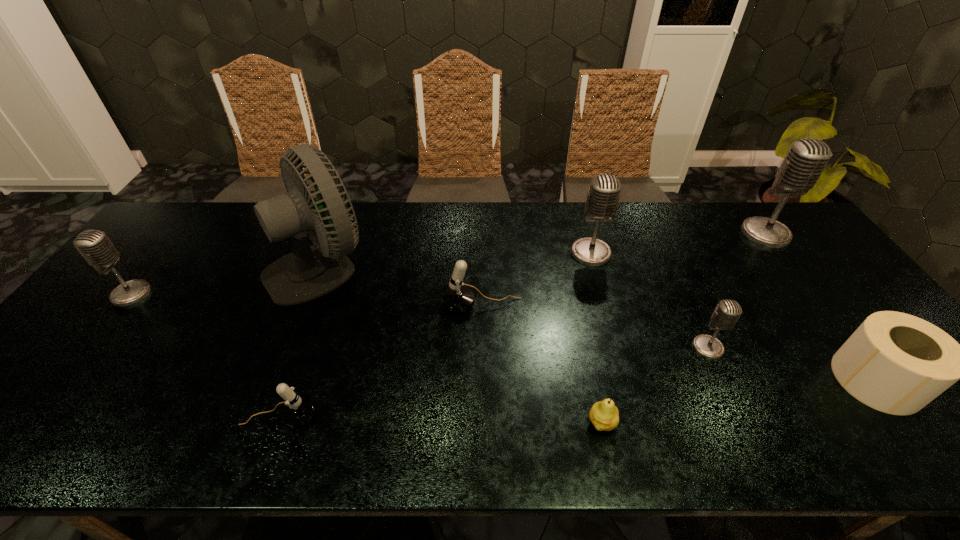
Identify the location of object at the far right corner. (806, 159).

In the image, there is a desktop. Where is `vacant space at the far edge`? Image resolution: width=960 pixels, height=540 pixels. vacant space at the far edge is located at coordinates (449, 241).

This screenshot has height=540, width=960. In order to click on vacant area at the near edge of the desktop in this screenshot , I will do coord(832,451).

The height and width of the screenshot is (540, 960). In the image, there is a desktop. Find the location of `free region at the left edge`. free region at the left edge is located at coordinates (124, 329).

In the image, there is a desktop. Identify the location of vacant space at the right edge. (787, 247).

This screenshot has width=960, height=540. Identify the location of free location at the far left corner. (187, 206).

I want to click on vacant area at the near left corner, so click(9, 429).

Locate an element on the screen. free space between the smaller white microphone and the third biggest gray microphone is located at coordinates (205, 355).

You are a GUI agent. You are given a task and a screenshot of the screen. Output one action in this format:
    pyautogui.click(x=<x>, y=<y>)
    Task: Click on the free area in between the second nearest microphone and the gray fan
    The width and height of the screenshot is (960, 540).
    Given the screenshot: What is the action you would take?
    pyautogui.click(x=515, y=307)

What are the coordinates of `free space between the second biggest gray microphone and the farther white microphone` in the screenshot? It's located at (537, 279).